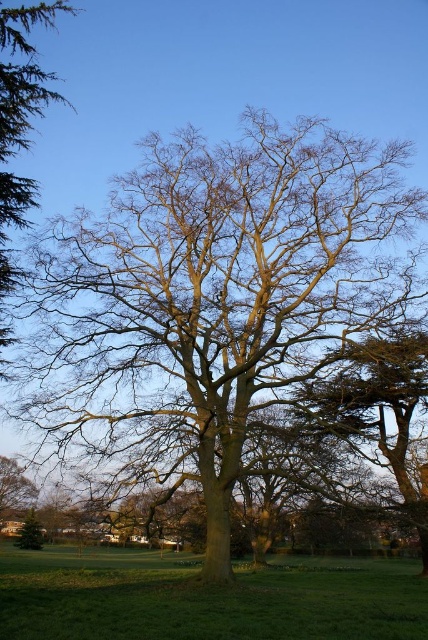
Who is positioned more to the right, smooth brown tree at upper left or brown textured tree at center?

Positioned to the right is smooth brown tree at upper left.

This screenshot has width=428, height=640. In order to click on smooth brown tree at upper left in this screenshot , I will do `click(20, 124)`.

From the picture: Does green grassy field at lower center have a larger size compared to bare branches at center?

Yes, green grassy field at lower center is bigger than bare branches at center.

Can you confirm if green grassy field at lower center is smaller than bare branches at center?

No.

Image resolution: width=428 pixels, height=640 pixels. What are the coordinates of `green grassy field at lower center` in the screenshot? It's located at (205, 600).

Based on the photo, does smooth brown tree at center have a smaller size compared to bare branches at center?

No.

Who is positioned more to the right, smooth brown tree at center or bare branches at center?

From the viewer's perspective, smooth brown tree at center appears more on the right side.

Who is more distant from viewer, (315, 406) or (20, 500)?

The point (20, 500) is more distant.

Identify the location of smooth brown tree at center. Image resolution: width=428 pixels, height=640 pixels. (377, 410).